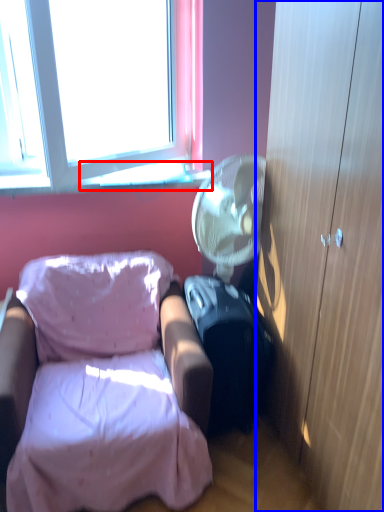
Question: Which point is closer to the camera, window sill (highlighted by a red box) or cabinetry (highlighted by a blue box)?

Choices:
 (A) window sill
 (B) cabinetry

Answer: (B)